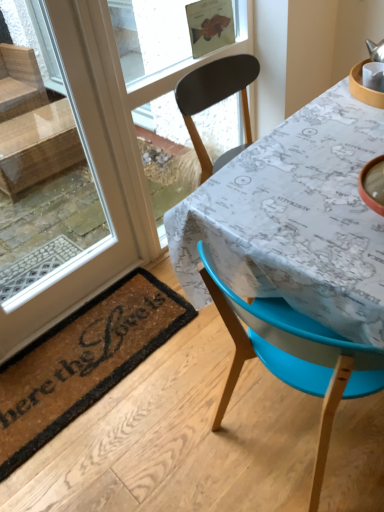
Identify the location of free space that is to the left of blue plastic chair at lower right. (166, 438).